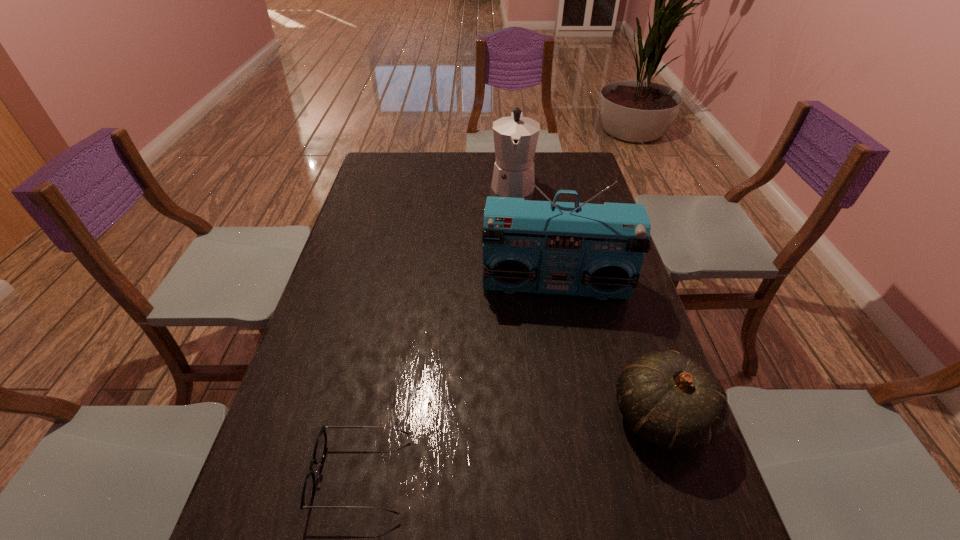
The width and height of the screenshot is (960, 540). I want to click on blank space located at the spout of the third shortest object, so click(x=512, y=237).

I want to click on free space located 0.370m at the spout of the third shortest object, so click(x=510, y=273).

You are a GUI agent. You are given a task and a screenshot of the screen. Output one action in this format:
    pyautogui.click(x=<x>, y=<y>)
    Task: Click on the vacant area situated at the spout of the third shortest object
    The height and width of the screenshot is (540, 960).
    Given the screenshot: What is the action you would take?
    pyautogui.click(x=511, y=258)

This screenshot has height=540, width=960. What are the coordinates of `object situated at the far edge` in the screenshot? It's located at (515, 137).

Locate an element on the screen. object located at the near edge is located at coordinates (308, 491).

Identify the location of object present at the left edge. This screenshot has height=540, width=960. (308, 491).

Where is `gourd at the right edge`? The image size is (960, 540). gourd at the right edge is located at coordinates (671, 402).

Locate an element on the screen. The width and height of the screenshot is (960, 540). radio receiver at the right edge is located at coordinates (596, 250).

Locate an element on the screen. The image size is (960, 540). object at the near left corner is located at coordinates (308, 491).

What are the coordinates of `vacant area at the far edge` in the screenshot? It's located at (435, 178).